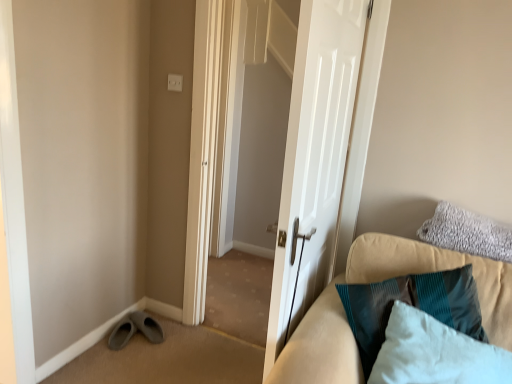
Question: Is gray fluffy pillow at upper right, placed as the 2th pillow when sorted from front to back, facing away from teal fabric couch at right?

Choices:
 (A) yes
 (B) no

Answer: (B)

Question: From a real-world perspective, does gray fluffy pillow at upper right, the first pillow from the back, stand above teal fabric couch at right?

Choices:
 (A) yes
 (B) no

Answer: (A)

Question: From the image's perspective, is gray fluffy pillow at upper right, which is the second pillow from bottom to top, located above teal fabric couch at right?

Choices:
 (A) yes
 (B) no

Answer: (A)

Question: From a real-world perspective, is gray fluffy pillow at upper right, placed as the 2th pillow when sorted from front to back, located beneath teal fabric couch at right?

Choices:
 (A) no
 (B) yes

Answer: (A)

Question: Can you confirm if gray fluffy pillow at upper right, placed as the 2th pillow when sorted from front to back, is thinner than teal fabric couch at right?

Choices:
 (A) yes
 (B) no

Answer: (B)

Question: Is point (506, 327) closer or farther from the camera than point (145, 337)?

Choices:
 (A) closer
 (B) farther

Answer: (A)

Question: Is teal fabric couch at right in front of or behind gray suede shoe at lower left in the image?

Choices:
 (A) behind
 (B) front

Answer: (B)

Question: Considering the positions of teal fabric couch at right and gray suede shoe at lower left in the image, is teal fabric couch at right bigger or smaller than gray suede shoe at lower left?

Choices:
 (A) big
 (B) small

Answer: (A)

Question: Do you think teal fabric couch at right is within gray suede shoe at lower left, or outside of it?

Choices:
 (A) inside
 (B) outside

Answer: (B)

Question: From a real-world perspective, is teal fabric couch at right positioned above or below white glossy door at center?

Choices:
 (A) below
 (B) above

Answer: (A)

Question: From the image's perspective, is teal fabric couch at right positioned above or below white glossy door at center?

Choices:
 (A) below
 (B) above

Answer: (A)

Question: Looking at their shapes, would you say teal fabric couch at right is wider or thinner than white glossy door at center?

Choices:
 (A) thin
 (B) wide

Answer: (B)

Question: Is teal fabric couch at right in front of or behind white glossy door at center in the image?

Choices:
 (A) behind
 (B) front

Answer: (B)

Question: From a real-world perspective, is white glossy door at center above or below teal fabric couch at right?

Choices:
 (A) below
 (B) above

Answer: (B)

Question: Is white glossy door at center wider or thinner than teal fabric couch at right?

Choices:
 (A) wide
 (B) thin

Answer: (B)